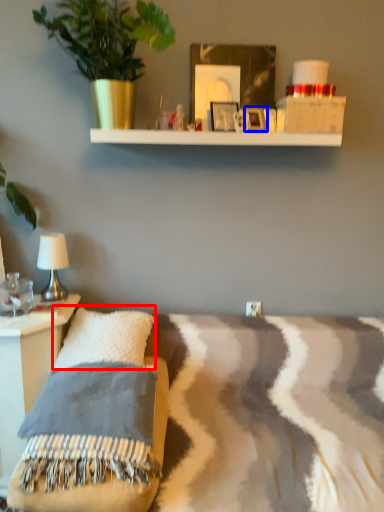
Question: Among these objects, which one is nearest to the camera, pillow (highlighted by a red box) or picture frame (highlighted by a blue box)?

Choices:
 (A) pillow
 (B) picture frame

Answer: (A)